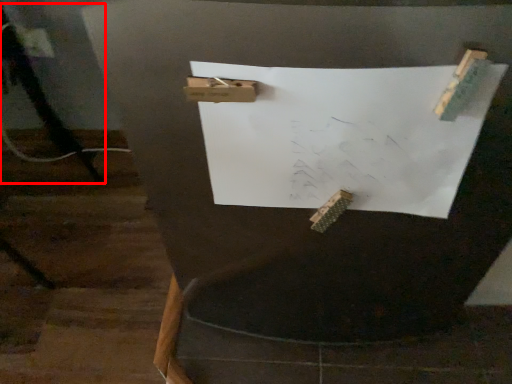
Question: From the image's perspective, considering the relative positions of tripod (annotated by the red box) and paper in the image provided, where is tripod (annotated by the red box) located with respect to the staircase?

Choices:
 (A) above
 (B) below

Answer: (A)